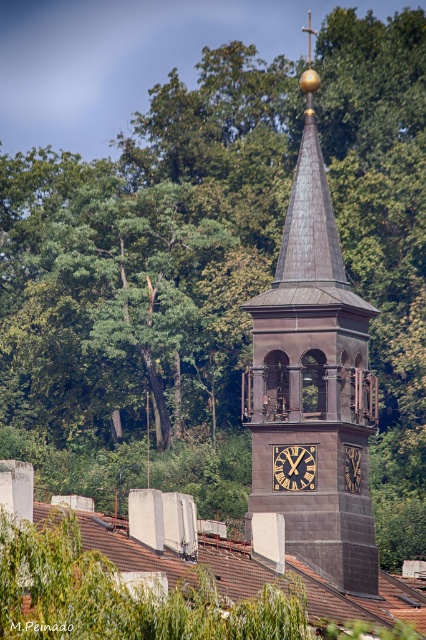
Who is lower down, dark gray stone clock tower at center or gold/black clock at center?

gold/black clock at center is lower down.

Consider the image. Who is positioned more to the left, dark gray stone clock tower at center or gold/black clock at center?

dark gray stone clock tower at center is more to the left.

Locate an element on the screen. This screenshot has height=640, width=426. dark gray stone clock tower at center is located at coordinates (314, 380).

Is gold metallic clock at center behind gold/black clock at center?

No.

Does gold metallic clock at center have a lesser width compared to gold/black clock at center?

No, gold metallic clock at center is not thinner than gold/black clock at center.

Describe the element at coordinates (293, 467) in the screenshot. I see `gold metallic clock at center` at that location.

Identify the location of gold metallic clock at center. The width and height of the screenshot is (426, 640). (293, 467).

Is dark gray stone clock tower at center closer to camera compared to gold metallic clock at center?

That is True.

Who is more distant from viewer, [334,400] or [273,456]?

Point [273,456]

You are a GUI agent. You are given a task and a screenshot of the screen. Output one action in this format:
    pyautogui.click(x=<x>, y=<y>)
    Task: Click on the dark gray stone clock tower at center
    
    Given the screenshot: What is the action you would take?
    pyautogui.click(x=314, y=380)